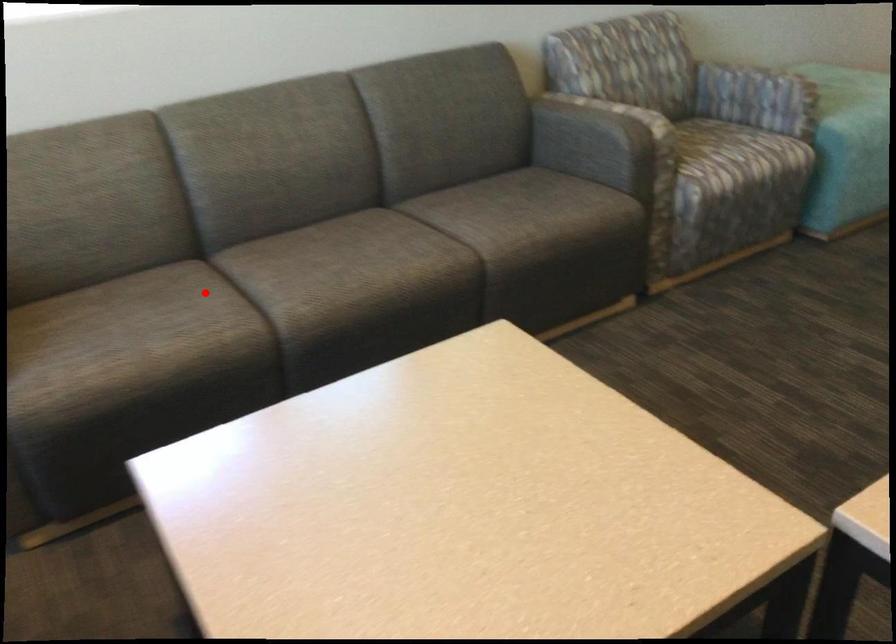
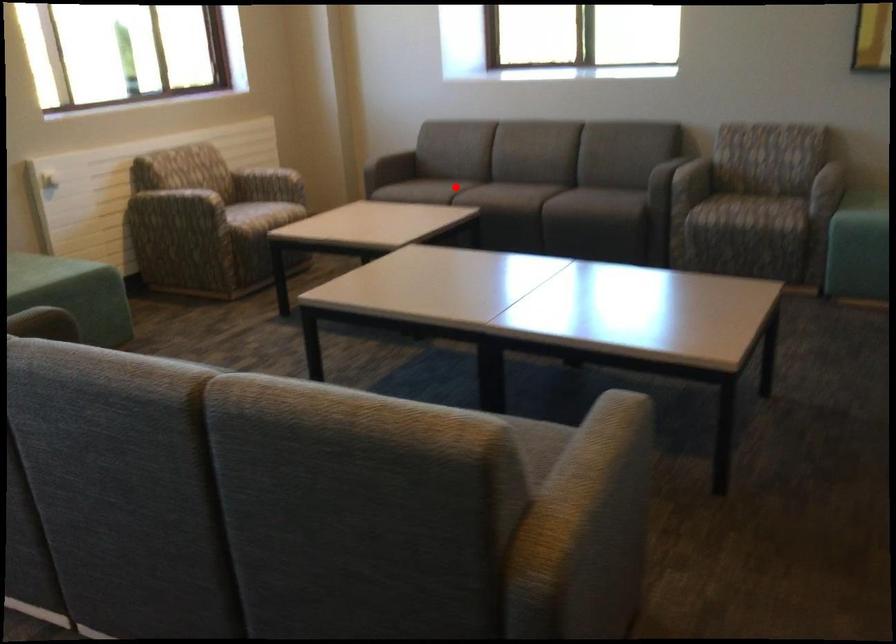
From the picture: I am providing you with two images of the same scene from different viewpoints. A red point is marked on the first image and another point is marked on the second image. Are the points marked in image1 and image2 representing the same 3D position?

Yes